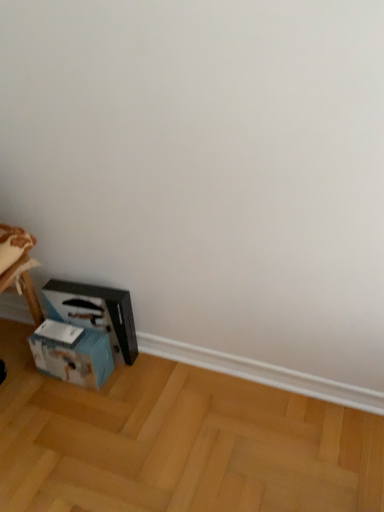
Image resolution: width=384 pixels, height=512 pixels. I want to click on vacant area on top of light brown wooden floor at lower left (from a real-world perspective), so click(x=138, y=434).